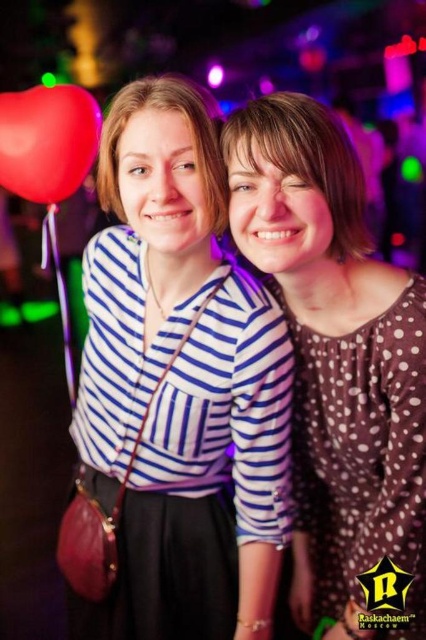
Is rubber heart at left smaller than matte striped shirt at center?

Indeed, rubber heart at left has a smaller size compared to matte striped shirt at center.

Does rubber heart at left have a larger size compared to matte striped shirt at center?

Actually, rubber heart at left might be smaller than matte striped shirt at center.

At what (x,y) coordinates should I click in order to perform the action: click on rubber heart at left. Please return your answer as a coordinate pair (x, y). The width and height of the screenshot is (426, 640). Looking at the image, I should click on (48, 140).

At what (x,y) coordinates should I click in order to perform the action: click on rubber heart at left. Please return your answer as a coordinate pair (x, y). Looking at the image, I should click on (48, 140).

This screenshot has width=426, height=640. Describe the element at coordinates (336, 355) in the screenshot. I see `brown dotted dress at center` at that location.

Does point (293, 332) come in front of point (62, 177)?

Yes.

Image resolution: width=426 pixels, height=640 pixels. What are the coordinates of `brown dotted dress at center` in the screenshot? It's located at (336, 355).

Is point (350, 189) positioned after point (336, 257)?

No, (350, 189) is in front of (336, 257).

Which is behind, point (288, 115) or point (258, 116)?

Point (258, 116)

The height and width of the screenshot is (640, 426). Identify the location of brown dotted dress at center. (336, 355).

Locate an element on the screen. This screenshot has width=426, height=640. brown dotted dress at center is located at coordinates (336, 355).